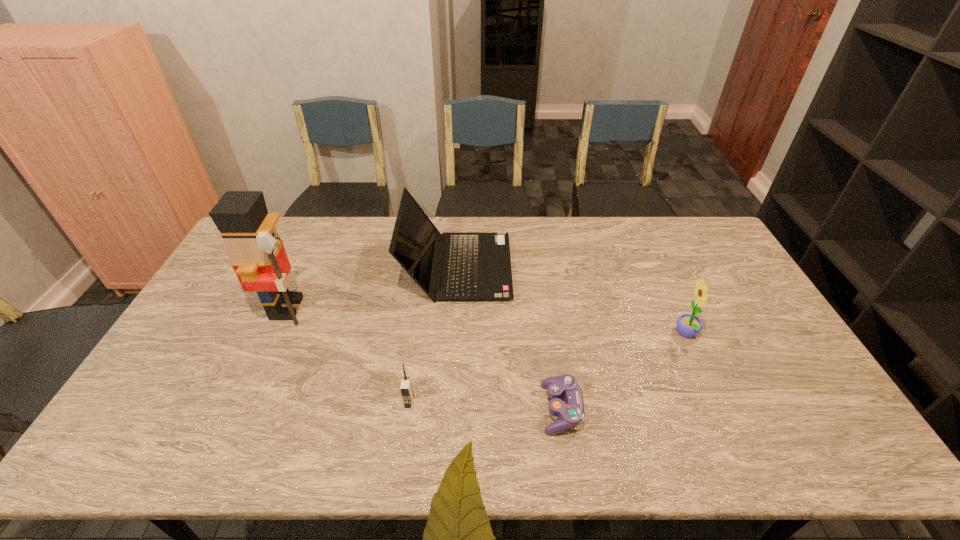
Identify the location of vacant space in between the second shortest object and the leftmost object. Image resolution: width=960 pixels, height=540 pixels. (348, 356).

The height and width of the screenshot is (540, 960). I want to click on vacant space in between the sunflower and the tallest object, so click(487, 321).

Where is `vacant region between the shortest object and the leftmost object`? vacant region between the shortest object and the leftmost object is located at coordinates (424, 359).

The width and height of the screenshot is (960, 540). Find the location of `vacant point located between the laptop computer and the second shortest object`. vacant point located between the laptop computer and the second shortest object is located at coordinates (433, 335).

You are a GUI agent. You are given a task and a screenshot of the screen. Output one action in this format:
    pyautogui.click(x=<x>, y=<y>)
    Task: Click on the blank region between the cellular telephone and the leftmost object
    The height and width of the screenshot is (540, 960).
    Given the screenshot: What is the action you would take?
    pyautogui.click(x=348, y=356)

You are a GUI agent. You are given a task and a screenshot of the screen. Output one action in this format:
    pyautogui.click(x=<x>, y=<y>)
    Task: Click on the vacant area that lies between the sunflower and the control
    This screenshot has width=960, height=540.
    Given the screenshot: What is the action you would take?
    pyautogui.click(x=624, y=372)

Locate an element on the screen. This screenshot has width=960, height=540. unoccupied area between the cellular telephone and the laptop computer is located at coordinates (433, 335).

Locate an element on the screen. The image size is (960, 540). free space between the second shortest object and the control is located at coordinates click(x=485, y=406).

This screenshot has height=540, width=960. Identify the location of free spot between the fourth object from left to right and the laptop computer. (509, 338).

This screenshot has height=540, width=960. I want to click on vacant point located between the fourth object from left to right and the cellular telephone, so click(485, 406).